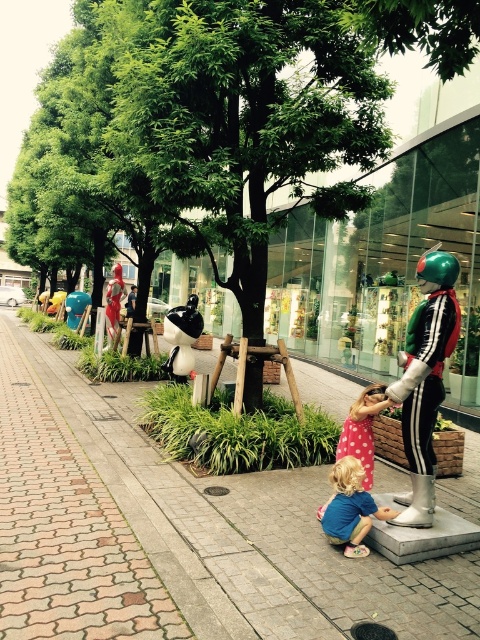
Question: Which point is closer to the camera taking this photo?

Choices:
 (A) (133, 388)
 (B) (416, 506)

Answer: (B)

Question: Among these objects, which one is farthest from the camera?

Choices:
 (A) shiny metallic robot at center right
 (B) pink polka dot dress at center
 (C) brick pavement at center
 (D) blue cotton shirt at lower center

Answer: (B)

Question: Does blue cotton shirt at lower center have a lesser width compared to pink polka dot dress at center?

Choices:
 (A) no
 (B) yes

Answer: (A)

Question: Is brick pavement at center positioned behind shiny metallic robot at center right?

Choices:
 (A) no
 (B) yes

Answer: (A)

Question: Which of the following is the farthest from the observer?

Choices:
 (A) brick pavement at center
 (B) pink polka dot dress at center

Answer: (B)

Question: Is brick pavement at center positioned in front of blue cotton shirt at lower center?

Choices:
 (A) no
 (B) yes

Answer: (B)